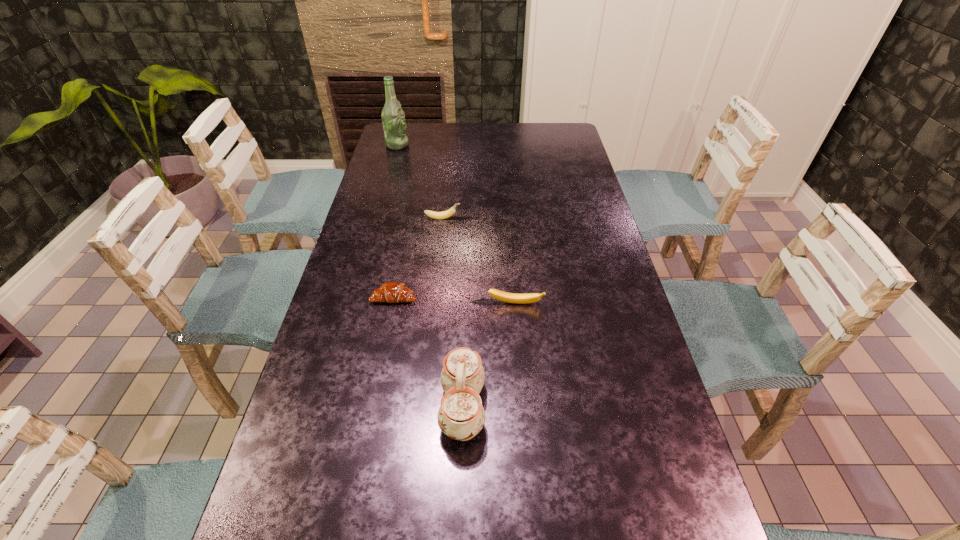
I want to click on free space at the right edge, so click(x=559, y=167).

Locate an element on the screen. free space at the far left corner is located at coordinates (408, 147).

Image resolution: width=960 pixels, height=540 pixels. Identify the location of unoccupied position between the left banana and the crescent roll. (419, 258).

What are the coordinates of `free space between the left banana and the nearer banana` in the screenshot? It's located at (479, 261).

At what (x,y) coordinates should I click in order to perform the action: click on free space between the fourth shortest object and the right banana. Please return your answer as a coordinate pair (x, y). This screenshot has width=960, height=540. Looking at the image, I should click on (489, 355).

In order to click on free spot between the farthest object and the chinaware in this screenshot , I will do `click(430, 276)`.

Where is `blank region between the crescent roll and the second farthest object`? blank region between the crescent roll and the second farthest object is located at coordinates (419, 258).

This screenshot has height=540, width=960. In order to click on vacant area that lies between the farthest object and the second tallest object in this screenshot , I will do `click(430, 276)`.

Where is `blank region between the farthest object and the chinaware`? The image size is (960, 540). blank region between the farthest object and the chinaware is located at coordinates (430, 276).

The height and width of the screenshot is (540, 960). In order to click on vacant space that is in between the tallest object and the farther banana in this screenshot , I will do `click(420, 181)`.